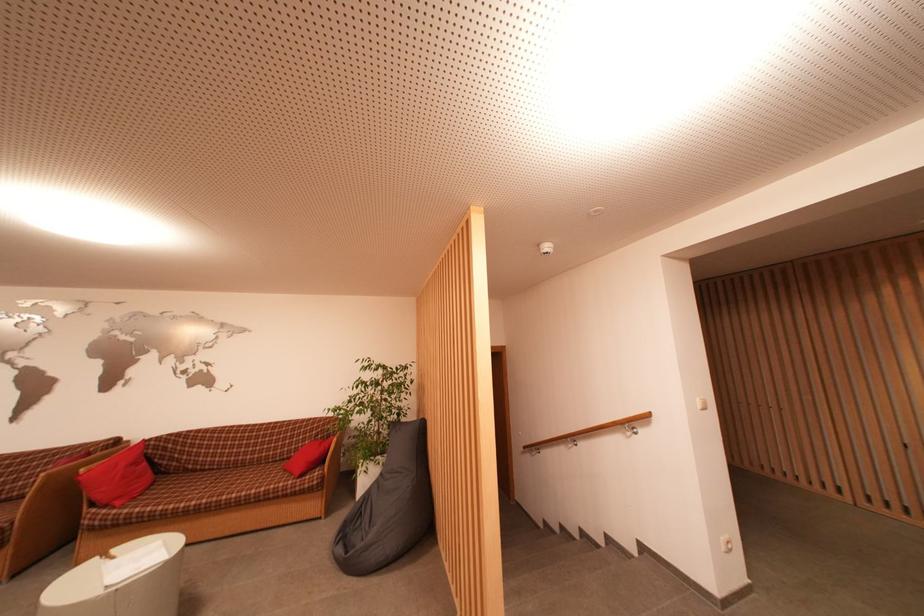
Describe the element at coordinates (700, 403) in the screenshot. The width and height of the screenshot is (924, 616). I see `a white light switch` at that location.